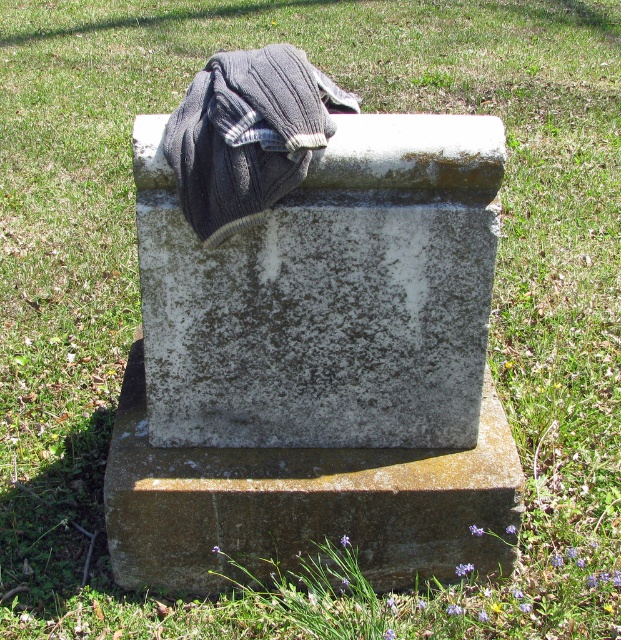
You are standing at a point in front of the monument and want to place a small flower at the base. If you look at the two points marked as point (414, 246) and point (279, 61), which point is closer to you?

Point (279, 61) is closer to you because it is in front of point (414, 246).

You are standing in front of the gray stone gravestone at center and the gray knitted blanket at upper center. Which object is significantly taller?

The gray stone gravestone at center is much taller than the gray knitted blanket at upper center according to the description.